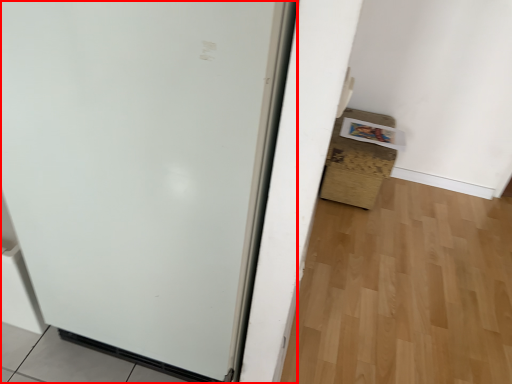
Question: From the image, what is the correct spatial relationship of door (annotated by the red box) in relation to cardboard box?

Choices:
 (A) right
 (B) left

Answer: (B)